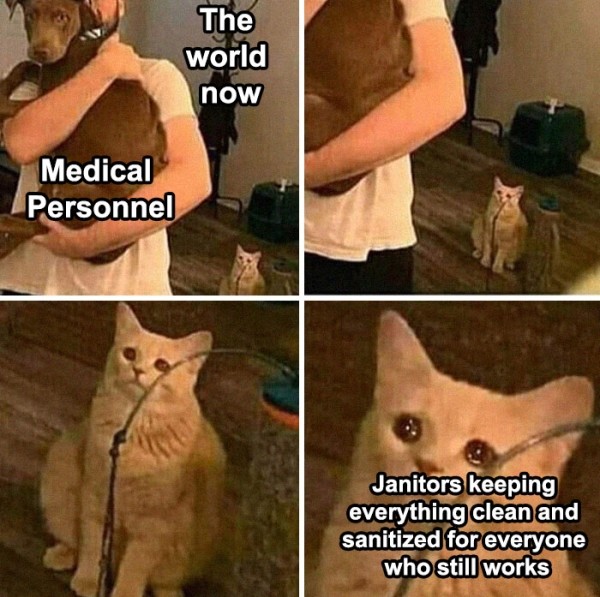
Where is `wooden floors`? The height and width of the screenshot is (597, 600). wooden floors is located at coordinates (201, 229), (444, 177), (29, 380), (348, 373).